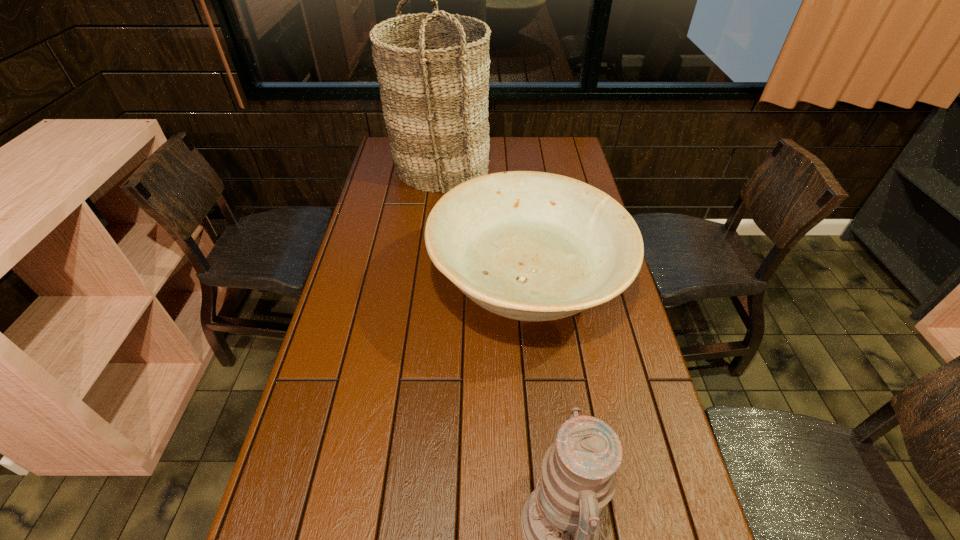
Where is `free location at the left edge of the desktop`? free location at the left edge of the desktop is located at coordinates (349, 251).

In the image, there is a desktop. Where is `free space at the right edge`? free space at the right edge is located at coordinates (576, 173).

At what (x,y) coordinates should I click in order to perform the action: click on object identified as the closest to the second nearest object. Please return your answer as a coordinate pair (x, y). The image size is (960, 540). Looking at the image, I should click on (435, 101).

Locate an element on the screen. object that is the second closest to the second farthest object is located at coordinates (560, 519).

Where is `vacant space that satisfies the following two spatial constraints: 1. on the front side of the farthest object; 2. on the left side of the second farthest object`? The width and height of the screenshot is (960, 540). vacant space that satisfies the following two spatial constraints: 1. on the front side of the farthest object; 2. on the left side of the second farthest object is located at coordinates (426, 289).